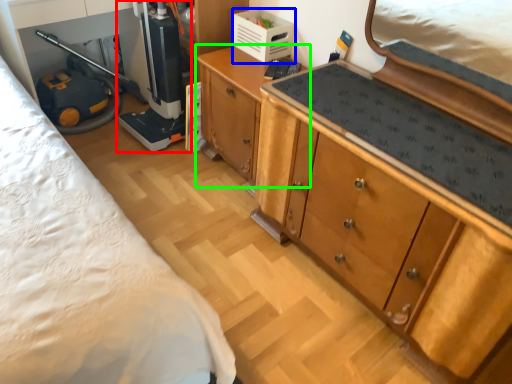
Question: Which object is positioned farthest from appliance (highlighted by a red box)? Select from appliance (highlighted by a blue box) and cabinetry (highlighted by a green box).

Choices:
 (A) appliance
 (B) cabinetry

Answer: (A)